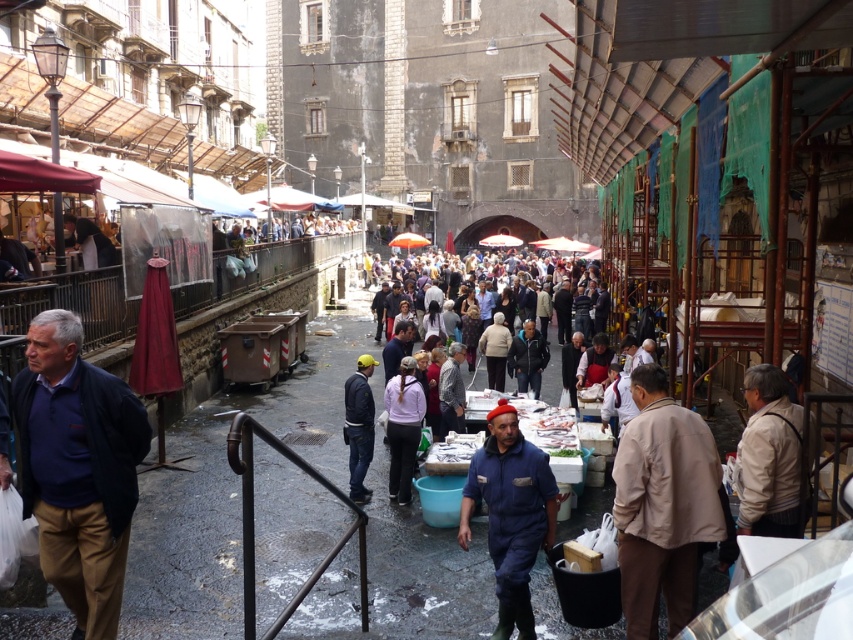
Question: Is blue denim jumpsuit at center thinner than light beige sweater at center?

Choices:
 (A) no
 (B) yes

Answer: (B)

Question: Which point is closer to the camera?

Choices:
 (A) (403, 476)
 (B) (700, 420)
 (C) (500, 388)
 (D) (469, 468)

Answer: (B)

Question: Which point appears closest to the camera in this image?

Choices:
 (A) (529, 605)
 (B) (358, 381)

Answer: (A)

Question: Which object is positioned closest to the light beige sweater at center?

Choices:
 (A) white matte jacket at center
 (B) dark blue fabric jacket at left
 (C) dark blue denim jacket at center

Answer: (C)

Question: Does dark blue fabric jacket at left lie in front of dark blue denim jacket at center?

Choices:
 (A) no
 (B) yes

Answer: (B)

Question: Can you confirm if beige fabric jacket at lower right is smaller than light beige sweater at center?

Choices:
 (A) yes
 (B) no

Answer: (B)